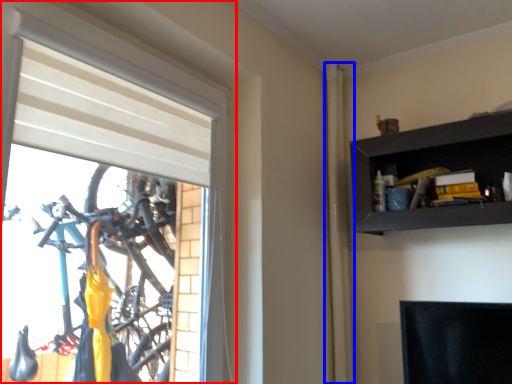
Question: Which object appears farthest to the camera in this image, window (highlighted by a red box) or curtain (highlighted by a blue box)?

Choices:
 (A) window
 (B) curtain

Answer: (B)